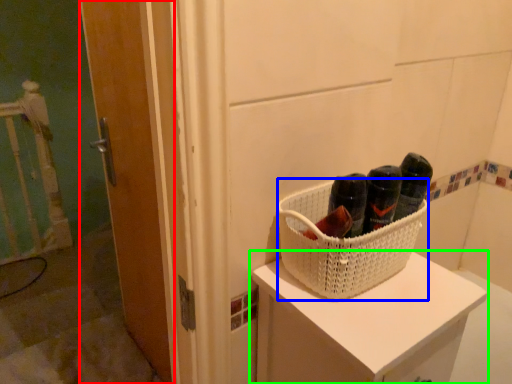
Question: Considering the real-world distances, which object is closest to door (highlighted by a red box)? basket (highlighted by a blue box) or furniture (highlighted by a green box).

Choices:
 (A) basket
 (B) furniture

Answer: (B)